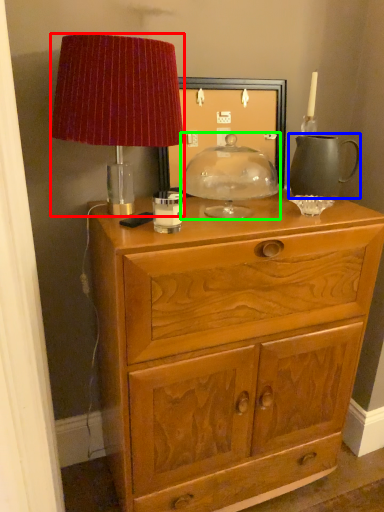
Question: Which object is positioned farthest from lamp (highlighted by a red box)? Select from tea pot (highlighted by a blue box) and candle holder (highlighted by a green box).

Choices:
 (A) tea pot
 (B) candle holder

Answer: (A)